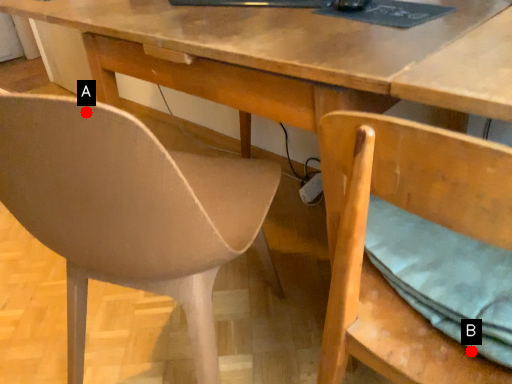
Question: Two points are circled on the image, labeled by A and B beside each circle. Among these points, which one is nearest to the camera?

Choices:
 (A) A is closer
 (B) B is closer

Answer: (A)